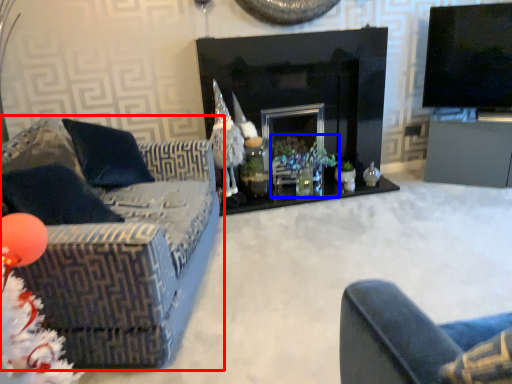
Question: Among these objects, which one is farthest to the camera, studio couch (highlighted by a red box) or christmas decoration (highlighted by a blue box)?

Choices:
 (A) studio couch
 (B) christmas decoration

Answer: (B)